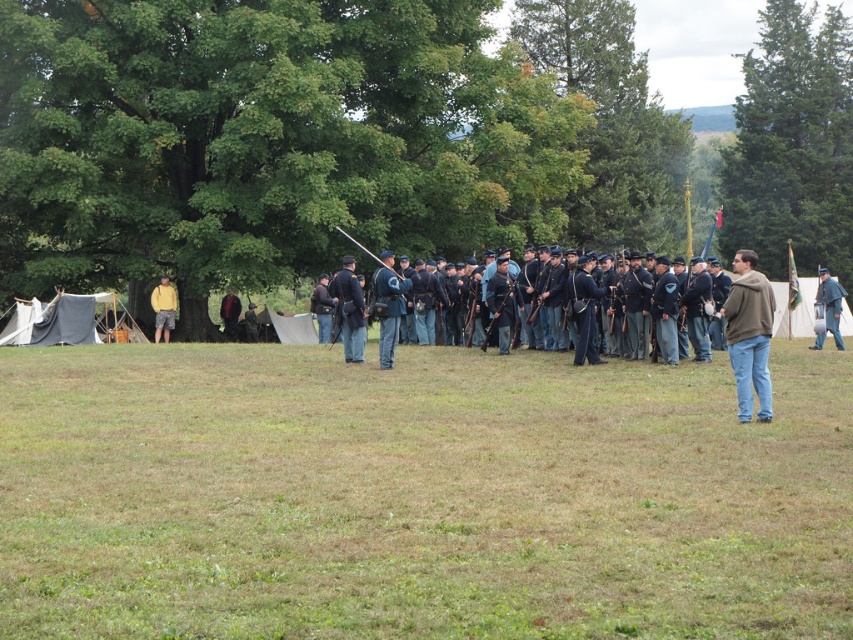
You are a photographer trying to capture a clear shot of the blue wool uniform at center and the dark brown leather jacket at center. Since you want to focus on the clothing details, which one should you zoom in on first to ensure it appears larger in your photo?

The dark brown leather jacket at center is taller than the blue wool uniform at center, so zooming in on the dark brown leather jacket at center first would make it appear larger in the photo.

You are a photographer positioned at the back of the formation. You want to take a photo of the blue cotton uniform at center and the yellow cotton shirt at left without any obstruction. Which subject should you focus on first to ensure both are in frame?

You should focus on the blue cotton uniform at center first since it is in front of the yellow cotton shirt at left, so capturing it first will allow the yellow cotton shirt at left to be visible behind it in the same frame.

You are a photographer at the historical reenactment. You need to capture a photo that includes both the blue cotton uniform at center and the yellow cotton shirt at left. Based on their positions, which one should be placed on the right side of the photo to ensure both are visible?

The blue cotton uniform at center should be placed on the right side of the photo because it is already positioned to the right of the yellow cotton shirt at left in the scene.